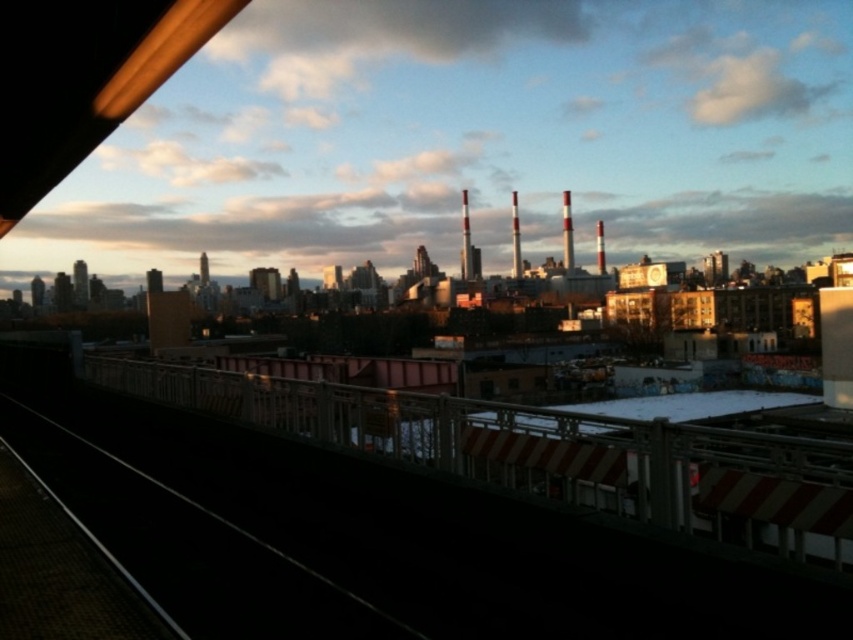
Does matte gray sky at upper center have a larger size compared to white metal rail at lower center?

Yes.

Between matte gray sky at upper center and white metal rail at lower center, which one has more height?

matte gray sky at upper center

Locate an element on the screen. matte gray sky at upper center is located at coordinates (469, 138).